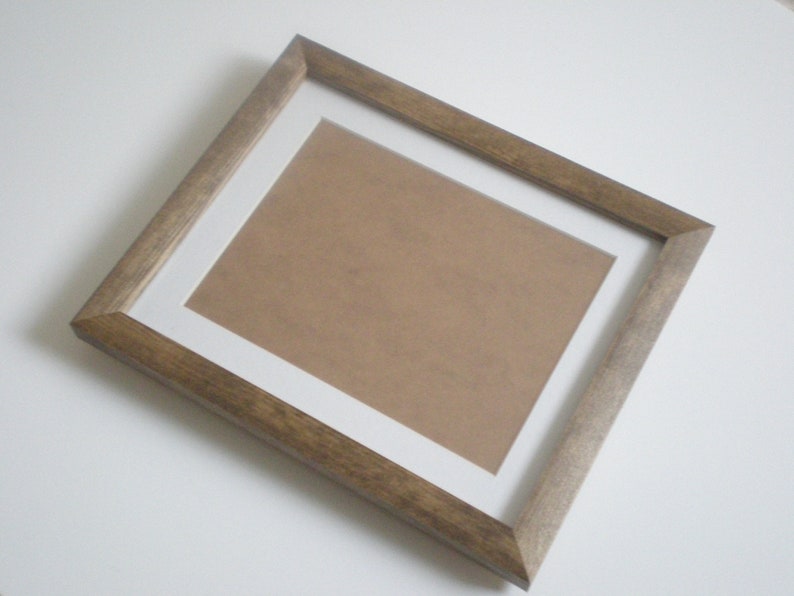
The image size is (794, 596). Find the location of `shadow of frame`. shadow of frame is located at coordinates (600, 346), (178, 170).